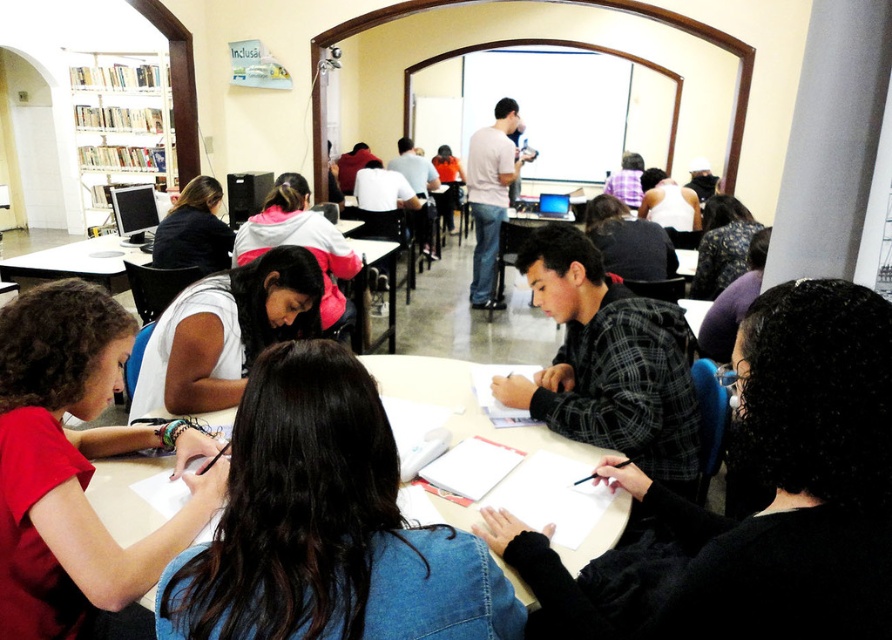
You are standing at the entrance of the classroom and see two points marked on the floor. The first point is at coordinate point(32,513) and the second point is at coordinate point(73,256). Which point is closer to you?

Point point(32,513) is in front of point point(73,256), so it is closer to you.

You are a student in the classroom and want to hand in your assignment. You see the white matte shirt at center and the white paper at center. Which object is closer to you?

The white paper at center is closer to you because the white matte shirt at center is located above it, meaning the paper is below and thus nearer.

You are a student in the classroom and you want to know which object is narrower between the white matte shirt at center and the white paper at center. Which one is it?

The white matte shirt at center is thinner than the white paper at center, so the white matte shirt at center is narrower.